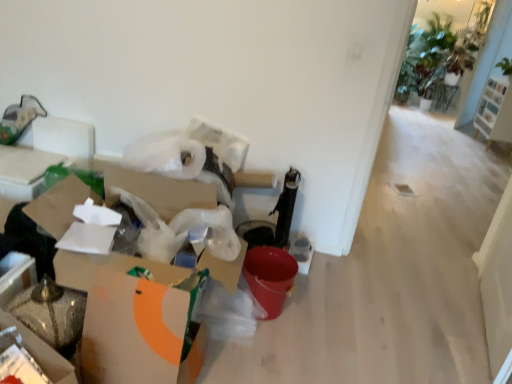
Question: Is white cardboard box at left, which ranks as the second cardboard box in front-to-back order, at the left side of white wood shoe rack at upper right?

Choices:
 (A) yes
 (B) no

Answer: (A)

Question: Is white cardboard box at left, which ranks as the second cardboard box in front-to-back order, positioned far away from white wood shoe rack at upper right?

Choices:
 (A) no
 (B) yes

Answer: (B)

Question: Can you confirm if white cardboard box at left, which ranks as the second cardboard box in front-to-back order, is wider than white wood shoe rack at upper right?

Choices:
 (A) yes
 (B) no

Answer: (A)

Question: Does white cardboard box at left, which ranks as the second cardboard box in front-to-back order, lie in front of white wood shoe rack at upper right?

Choices:
 (A) no
 (B) yes

Answer: (B)

Question: Could you tell me if white cardboard box at left, which ranks as the second cardboard box in front-to-back order, is facing white wood shoe rack at upper right?

Choices:
 (A) yes
 (B) no

Answer: (B)

Question: Are white cardboard box at left, which ranks as the second cardboard box in front-to-back order, and white wood shoe rack at upper right beside each other?

Choices:
 (A) yes
 (B) no

Answer: (B)

Question: Is white cardboard box at lower left, the 2th cardboard box positioned from the back, wider than white cardboard box at left, which ranks as the second cardboard box in front-to-back order?

Choices:
 (A) yes
 (B) no

Answer: (B)

Question: Is white cardboard box at lower left, positioned as the first cardboard box in front-to-back order, touching white cardboard box at left, the first cardboard box in the back-to-front sequence?

Choices:
 (A) yes
 (B) no

Answer: (A)

Question: From the image's perspective, would you say white cardboard box at lower left, positioned as the first cardboard box in front-to-back order, is positioned over white cardboard box at left, which ranks as the second cardboard box in front-to-back order?

Choices:
 (A) no
 (B) yes

Answer: (A)

Question: Is white cardboard box at lower left, positioned as the first cardboard box in front-to-back order, turned away from white cardboard box at left, the first cardboard box in the back-to-front sequence?

Choices:
 (A) no
 (B) yes

Answer: (B)

Question: Is white cardboard box at lower left, positioned as the first cardboard box in front-to-back order, bigger than white cardboard box at left, which ranks as the second cardboard box in front-to-back order?

Choices:
 (A) yes
 (B) no

Answer: (B)

Question: Is the position of white cardboard box at lower left, the 2th cardboard box positioned from the back, more distant than that of white cardboard box at left, which ranks as the second cardboard box in front-to-back order?

Choices:
 (A) yes
 (B) no

Answer: (B)

Question: Is white cardboard box at lower left, positioned as the first cardboard box in front-to-back order, taller than white wood shoe rack at upper right?

Choices:
 (A) no
 (B) yes

Answer: (A)